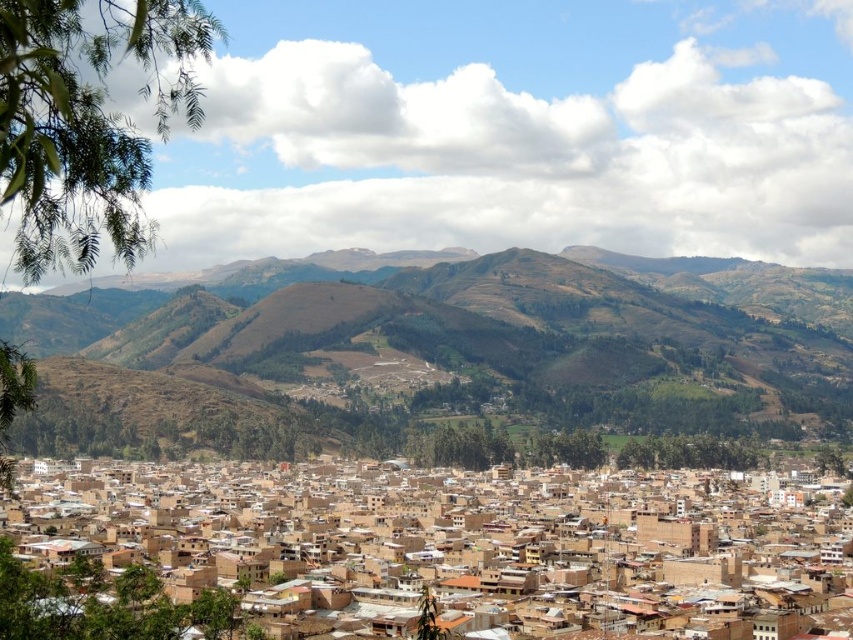
You are an urban planner analyzing this city layout. Based on the scene, which of the two elements, the brown clay buildings at center or the brown textured hillside at center, is positioned lower in the image?

The brown clay buildings at center are positioned below the brown textured hillside at center, so they are lower in the image.

You are an urban planner assessing the city layout. Given the brown clay buildings at center and the brown textured hillside at center, which one occupies more space in the scene?

The brown clay buildings at center is larger in size than brown textured hillside at center, so it occupies more space in the scene.